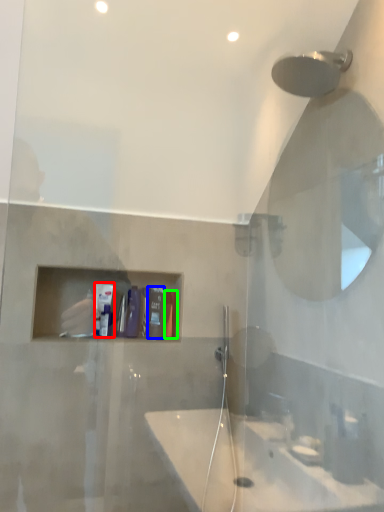
Question: Which is farther away from toiletry (highlighted by a red box)? toiletry (highlighted by a blue box) or toiletry (highlighted by a green box)?

Choices:
 (A) toiletry
 (B) toiletry

Answer: (B)